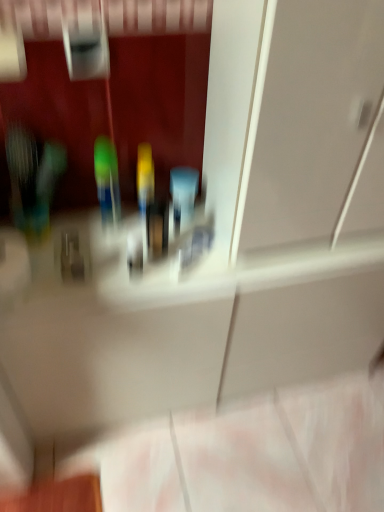
The width and height of the screenshot is (384, 512). Identify the location of vacant area in front of green plastic toothbrush at center. (102, 264).